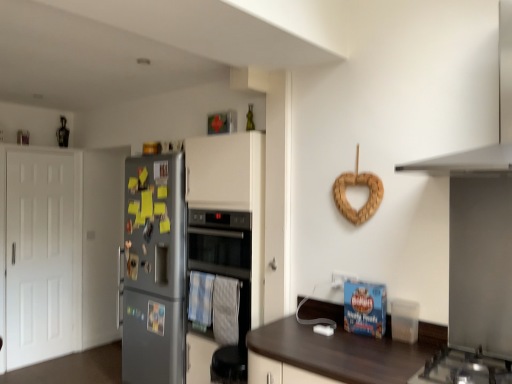
Image resolution: width=512 pixels, height=384 pixels. I want to click on stainless steel gas stove at lower right, so click(465, 368).

This screenshot has width=512, height=384. What do you see at coordinates (404, 320) in the screenshot? I see `clear plastic container at lower right` at bounding box center [404, 320].

Consider the image. What is the approximate width of white matte exhaust hood at upper right?

white matte exhaust hood at upper right is 20.07 inches wide.

Based on the photo, in order to face white matte exhaust hood at upper right, should I rotate leftwards or rightwards?

To align with it, rotate right about 26.594°.

The width and height of the screenshot is (512, 384). What are the coordinates of `white matte door at left` in the screenshot? It's located at (42, 256).

Locate an element on the screen. The height and width of the screenshot is (384, 512). stainless steel gas stove at lower right is located at coordinates (465, 368).

Is clear plastic container at lower right facing towards white matte door at left?

No, clear plastic container at lower right is not facing towards white matte door at left.

Would you consider clear plastic container at lower right to be distant from white matte door at left?

Yes, clear plastic container at lower right is far from white matte door at left.

Based on the photo, what's the angular difference between clear plastic container at lower right and white matte door at left's facing directions?

The facing directions of clear plastic container at lower right and white matte door at left are 98.4 degrees apart.

Identify the location of refrigerator behind the black glass oven at center. (155, 270).

Which of these two, satin silver fridge at left or black glass oven at center, is thinner?

black glass oven at center.

Considering the relative sizes of satin silver fridge at left and black glass oven at center in the image provided, is satin silver fridge at left taller than black glass oven at center?

Yes.

Does satin silver fridge at left lie behind black glass oven at center?

Yes, satin silver fridge at left is behind black glass oven at center.

Is clear plastic container at lower right positioned beyond the bounds of black glass oven at center?

That's correct, clear plastic container at lower right is outside of black glass oven at center.

Is clear plastic container at lower right aimed at black glass oven at center?

No, clear plastic container at lower right is not aimed at black glass oven at center.

Which object is further away from the camera, clear plastic container at lower right or black glass oven at center?

black glass oven at center is more distant.

Is point (400, 339) less distant than point (209, 219)?

Yes, point (400, 339) is in front of point (209, 219).

Which point is more forward, [156,284] or [398,311]?

Point [398,311]

Can you confirm if satin silver fridge at left is wider than clear plastic container at lower right?

Yes.

From a real-world perspective, is satin silver fridge at left over clear plastic container at lower right?

No.

From a real-world perspective, is black glass oven at center located higher than clear plastic container at lower right?

Yes, from a real-world perspective, black glass oven at center is on top of clear plastic container at lower right.

What's the angular difference between black glass oven at center and clear plastic container at lower right's facing directions?

They differ by 8.67 degrees in their facing directions.

Does black glass oven at center touch clear plastic container at lower right?

No, black glass oven at center is not beside clear plastic container at lower right.

Is black glass oven at center facing away from clear plastic container at lower right?

black glass oven at center does not have its back to clear plastic container at lower right.

Considering the points (426, 382) and (138, 319), which point is behind, point (426, 382) or point (138, 319)?

Positioned behind is point (138, 319).

Can you tell me how much stainless steel gas stove at lower right and satin silver fridge at left differ in facing direction?

They differ by 1.87 degrees in their facing directions.

Based on the photo, is stainless steel gas stove at lower right oriented away from satin silver fridge at left?

stainless steel gas stove at lower right is not turned away from satin silver fridge at left.

From the picture: Considering the relative positions of stainless steel gas stove at lower right and satin silver fridge at left in the image provided, is stainless steel gas stove at lower right to the right of satin silver fridge at left from the viewer's perspective?

Yes.

Which of these two, white matte door at left or white matte exhaust hood at upper right, is smaller?

white matte exhaust hood at upper right is smaller.

Looking at this image, from a real-world perspective, is white matte door at left physically above white matte exhaust hood at upper right?

No, from a real-world perspective, white matte door at left is not above white matte exhaust hood at upper right.

Is point (71, 342) positioned after point (497, 91)?

Yes, it is.

Identify the location of door that appears behind the clear plastic container at lower right. (42, 256).

At what (x,y) coordinates should I click in order to perform the action: click on refrigerator below the black glass oven at center (from the image's perspective). Please return your answer as a coordinate pair (x, y). Looking at the image, I should click on (155, 270).

Which object lies nearer to the anchor point satin silver fridge at left, black glass oven at center or white matte exhaust hood at upper right?

Among the two, black glass oven at center is located nearer to satin silver fridge at left.

Based on their spatial positions, is black glass oven at center or white matte door at left closer to white matte exhaust hood at upper right?

black glass oven at center is closer to white matte exhaust hood at upper right.

Consider the image. Estimate the real-world distances between objects in this image. Which object is further from stainless steel gas stove at lower right, white matte exhaust hood at upper right or satin silver fridge at left?

satin silver fridge at left lies further to stainless steel gas stove at lower right than the other object.

Considering their positions, is stainless steel gas stove at lower right positioned further to clear plastic container at lower right than white matte exhaust hood at upper right?

white matte exhaust hood at upper right is further to clear plastic container at lower right.

Estimate the real-world distances between objects in this image. Which object is closer to stainless steel gas stove at lower right, satin silver fridge at left or white matte exhaust hood at upper right?

Among the two, white matte exhaust hood at upper right is located nearer to stainless steel gas stove at lower right.

Looking at the image, which one is located closer to satin silver fridge at left, white matte exhaust hood at upper right or clear plastic container at lower right?

clear plastic container at lower right is closer to satin silver fridge at left.

Estimate the real-world distances between objects in this image. Which object is closer to white matte exhaust hood at upper right, satin silver fridge at left or white matte door at left?

Among the two, satin silver fridge at left is located nearer to white matte exhaust hood at upper right.

Looking at the image, which one is located closer to satin silver fridge at left, black glass oven at center or stainless steel gas stove at lower right?

black glass oven at center lies closer to satin silver fridge at left than the other object.

This screenshot has width=512, height=384. In order to click on appliance between white matte door at left and white matte exhaust hood at upper right from left to right in this screenshot , I will do `click(404, 320)`.

Find the location of a particular element. This screenshot has width=512, height=384. appliance between stainless steel gas stove at lower right and black glass oven at center along the z-axis is located at coordinates (404, 320).

Where is `appliance between satin silver fridge at left and white matte exhaust hood at upper right from left to right`? Image resolution: width=512 pixels, height=384 pixels. appliance between satin silver fridge at left and white matte exhaust hood at upper right from left to right is located at coordinates (404, 320).

Locate an element on the screen. This screenshot has height=384, width=512. oven between satin silver fridge at left and clear plastic container at lower right from left to right is located at coordinates [224, 254].